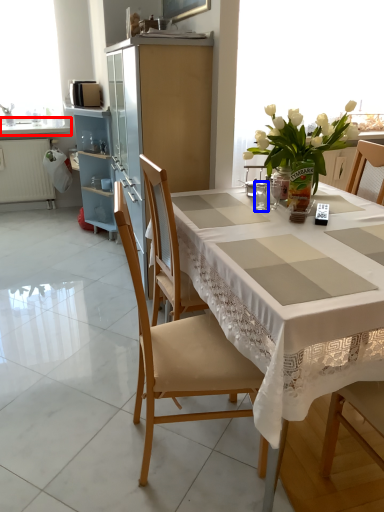
Question: Among these objects, which one is nearest to the camera, countertop (highlighted by a red box) or tableware (highlighted by a blue box)?

Choices:
 (A) countertop
 (B) tableware

Answer: (B)